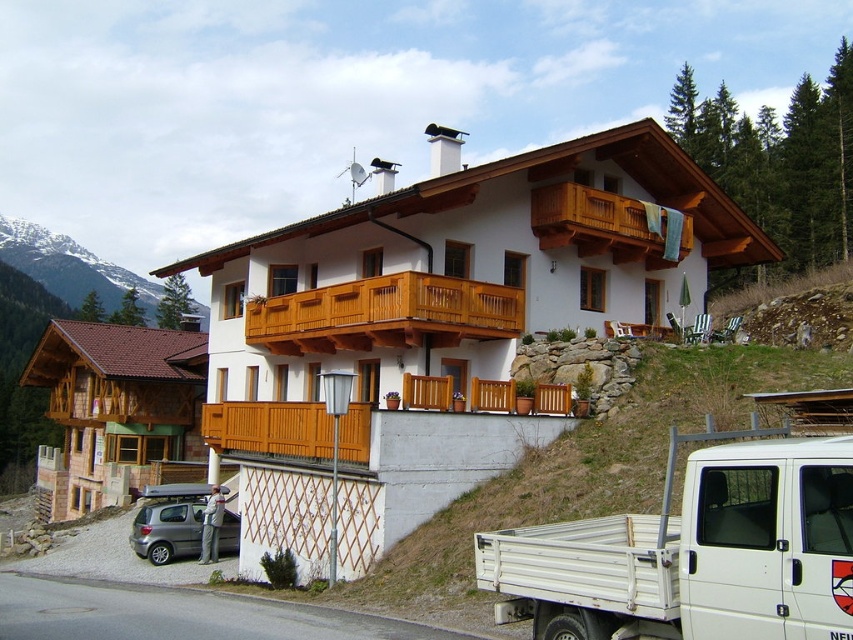
Is point (395, 236) closer to viewer compared to point (444, 296)?

No, (395, 236) is further to viewer.

Consider the image. Does white wooden chalet at center have a lesser width compared to wooden at center?

No, white wooden chalet at center is not thinner than wooden at center.

Is point (381, 296) positioned before point (315, 296)?

Yes, point (381, 296) is in front of point (315, 296).

Where is `white wooden chalet at center`? The height and width of the screenshot is (640, 853). white wooden chalet at center is located at coordinates (456, 266).

Is white metallic truck at lower right taller than metallic gray hatchback at lower left?

In fact, white metallic truck at lower right may be shorter than metallic gray hatchback at lower left.

Which is in front, point (521, 612) or point (181, 508)?

Point (521, 612)

The image size is (853, 640). I want to click on white metallic truck at lower right, so pyautogui.click(x=695, y=552).

Does wooden balcony at upper center have a greater height compared to metallic gray hatchback at lower left?

Correct, wooden balcony at upper center is much taller as metallic gray hatchback at lower left.

Who is more distant from viewer, (x=602, y=195) or (x=236, y=545)?

Answer: Point (x=602, y=195)

Between point (573, 218) and point (178, 545), which one is positioned in front?

Point (573, 218) is in front.

Locate an element on the screen. wooden balcony at upper center is located at coordinates (606, 225).